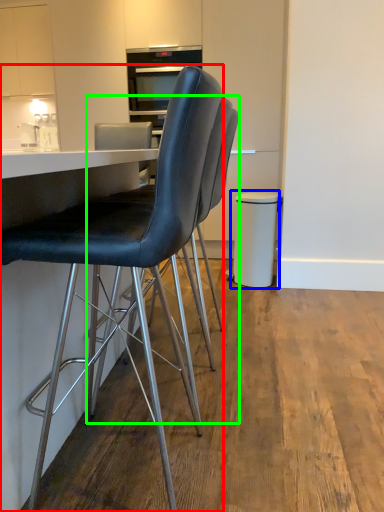
Question: Which object is the closest to the chair (highlighted by a red box)? Choose among these: bar stool (highlighted by a blue box) or chair (highlighted by a green box).

Choices:
 (A) bar stool
 (B) chair

Answer: (B)